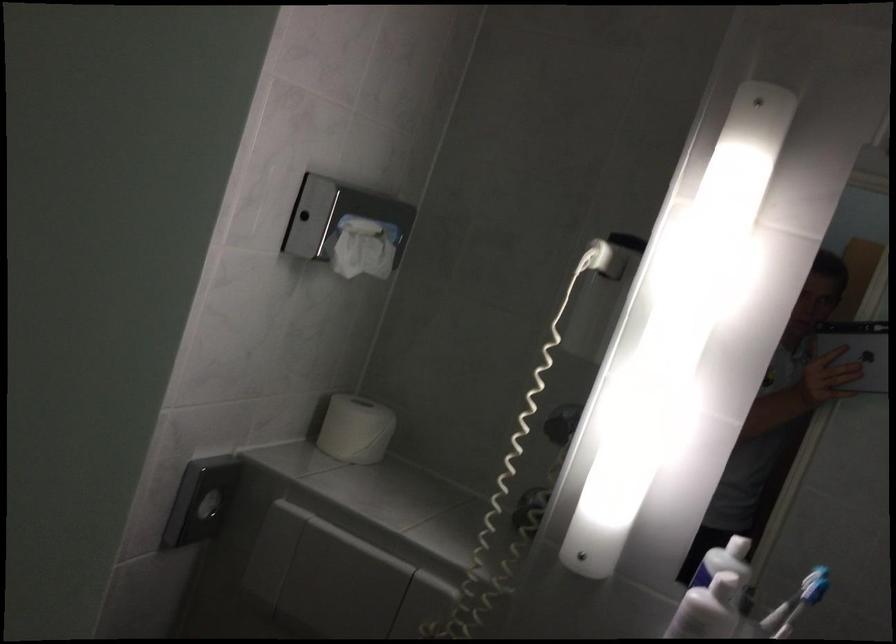
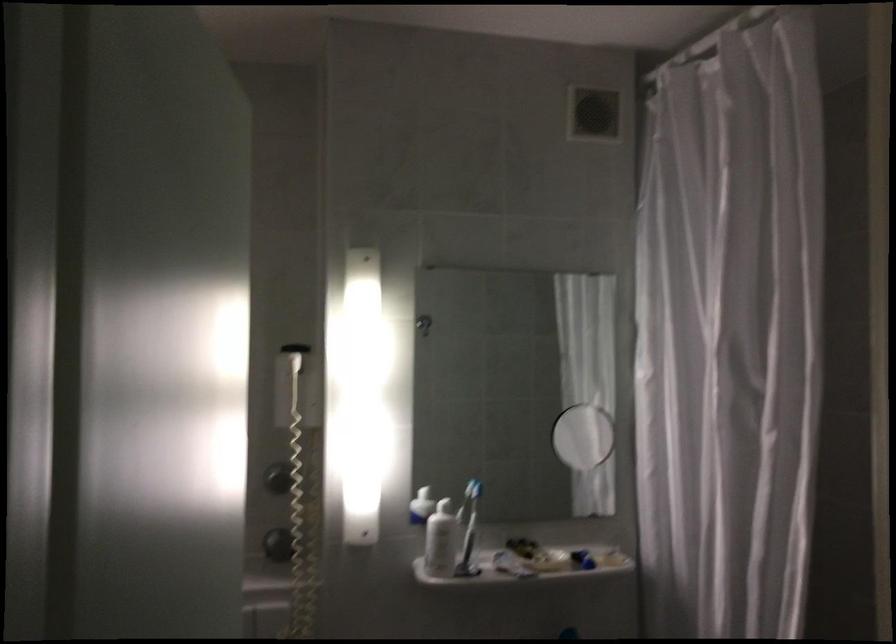
In the second image, find the point that corresponds to point (596, 303) in the first image.

(293, 384)